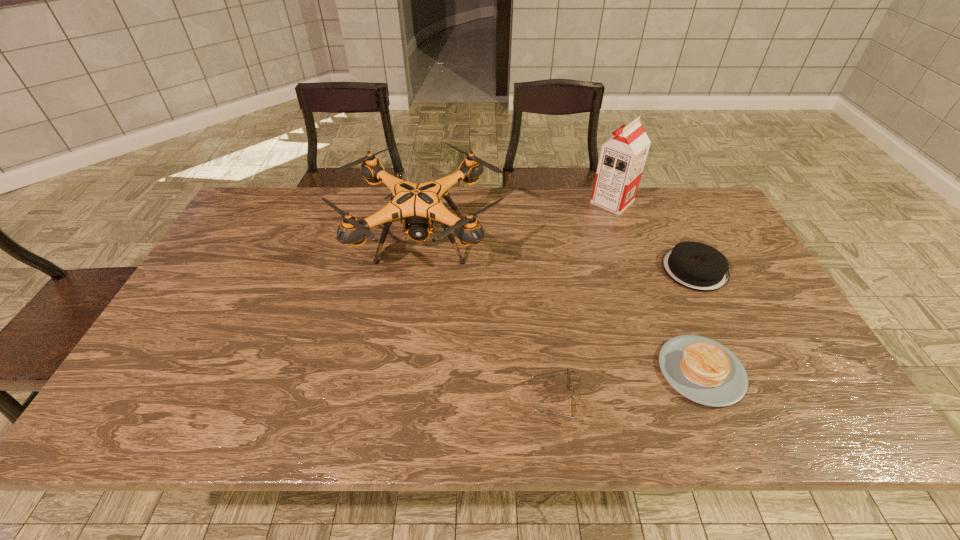
The image size is (960, 540). I want to click on vacant space at the left edge of the desktop, so click(x=168, y=332).

Locate an element on the screen. This screenshot has width=960, height=540. blank space at the right edge is located at coordinates (780, 384).

In order to click on vacant space at the far left corner in this screenshot , I will do 296,200.

In the image, there is a desktop. Where is `vacant area at the near left corner`? The image size is (960, 540). vacant area at the near left corner is located at coordinates (128, 430).

You are a GUI agent. You are given a task and a screenshot of the screen. Output one action in this format:
    pyautogui.click(x=<x>, y=<y>)
    Task: Click on the vacant space at the near right corner
    The height and width of the screenshot is (540, 960).
    Given the screenshot: What is the action you would take?
    pyautogui.click(x=798, y=406)

Find the location of a particular element. The image size is (960, 540). free spot between the soya milk and the nearer pancake is located at coordinates (657, 286).

The height and width of the screenshot is (540, 960). In order to click on free space between the farther pancake and the fourth object from right to left in this screenshot , I will do pyautogui.click(x=623, y=334).

Locate an element on the screen. The height and width of the screenshot is (540, 960). unoccupied area between the soya milk and the nearer pancake is located at coordinates (657, 286).

In order to click on free space between the spectacles and the farther pancake in this screenshot , I will do `click(623, 334)`.

Locate an element on the screen. The width and height of the screenshot is (960, 540). blank region between the farther pancake and the spectacles is located at coordinates (623, 334).